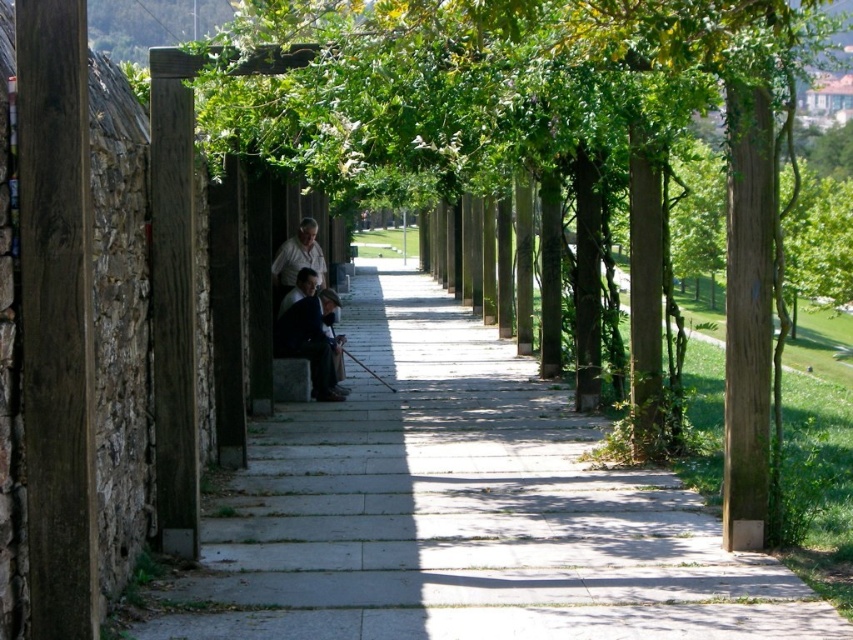
Based on the photo, you are a delivery person carrying a package and need to step onto the gray concrete pavement at center and the dark gray suit at center. Which surface is lower to the ground?

The gray concrete pavement at center is lower to the ground compared to the dark gray suit at center.

You are a delivery person who needs to walk through the walkway while carrying a large box. The box is as wide as the dark gray suit at center. Can you walk through the gray concrete pavement at center without the box touching either side?

The gray concrete pavement at center is wider than the dark gray suit at center. Since the box is as wide as the dark gray suit at center, there will be enough space on both sides of the box to walk through the gray concrete pavement at center without touching either side.

You are standing at the entrance of the walkway and want to place a small potted plant on the gray concrete pavement at center so that it is visible to people approaching from the distance. However, you also need to ensure that the matte black jacket at center is not blocked by the plant. Based on their positions, is this possible?

The gray concrete pavement at center is closer to the viewer than the matte black jacket at center. Therefore, placing the plant on the pavement would not block the jacket since the jacket is further away. The plant will be in front of the jacket, making both visible to approaching people.